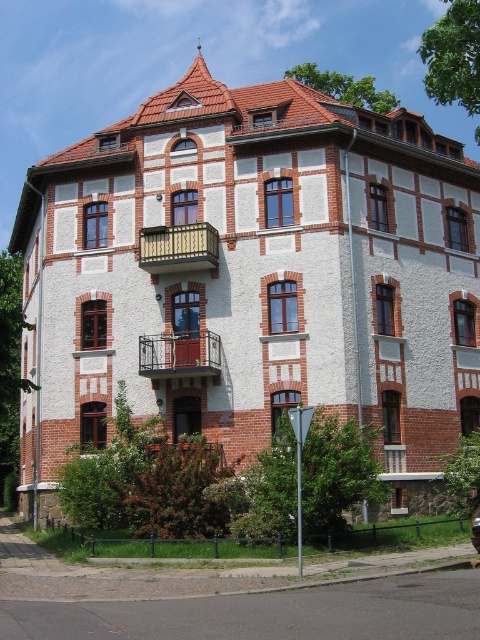
You are standing in front of the residential building and want to know which balcony is closer to you. The brown wooden balcony at center and the rustic metal balcony at center are both at the center. Which one is closer?

The brown wooden balcony at center is closer to you because it is positioned further to the viewer than the rustic metal balcony at center.